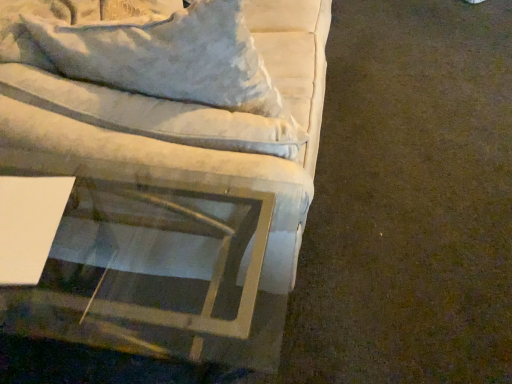
Question: From a real-world perspective, is clear glass table at lower left positioned under velvet white couch at upper left based on gravity?

Choices:
 (A) no
 (B) yes

Answer: (B)

Question: Can you confirm if clear glass table at lower left is smaller than velvet white couch at upper left?

Choices:
 (A) no
 (B) yes

Answer: (A)

Question: Is clear glass table at lower left bigger than velvet white couch at upper left?

Choices:
 (A) no
 (B) yes

Answer: (B)

Question: Is clear glass table at lower left positioned in front of velvet white couch at upper left?

Choices:
 (A) no
 (B) yes

Answer: (B)

Question: Does clear glass table at lower left have a greater height compared to velvet white couch at upper left?

Choices:
 (A) no
 (B) yes

Answer: (B)

Question: Can you confirm if clear glass table at lower left is wider than velvet white couch at upper left?

Choices:
 (A) yes
 (B) no

Answer: (A)

Question: Is velvet white couch at upper left at the right side of clear glass table at lower left?

Choices:
 (A) yes
 (B) no

Answer: (A)

Question: From the image's perspective, is velvet white couch at upper left on top of clear glass table at lower left?

Choices:
 (A) no
 (B) yes

Answer: (B)

Question: Can you confirm if velvet white couch at upper left is shorter than clear glass table at lower left?

Choices:
 (A) yes
 (B) no

Answer: (A)

Question: Is velvet white couch at upper left next to clear glass table at lower left and touching it?

Choices:
 (A) yes
 (B) no

Answer: (B)

Question: Is velvet white couch at upper left positioned behind clear glass table at lower left?

Choices:
 (A) yes
 (B) no

Answer: (A)

Question: From a real-world perspective, is velvet white couch at upper left on top of clear glass table at lower left?

Choices:
 (A) yes
 (B) no

Answer: (A)

Question: Is velvet white couch at upper left in front of or behind clear glass table at lower left in the image?

Choices:
 (A) front
 (B) behind

Answer: (B)